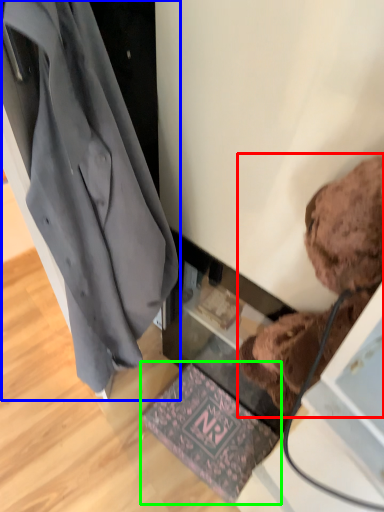
Question: Considering the real-world distances, which object is closest to teddy bear (highlighted by a red box)? coat (highlighted by a blue box) or mat (highlighted by a green box).

Choices:
 (A) coat
 (B) mat

Answer: (A)